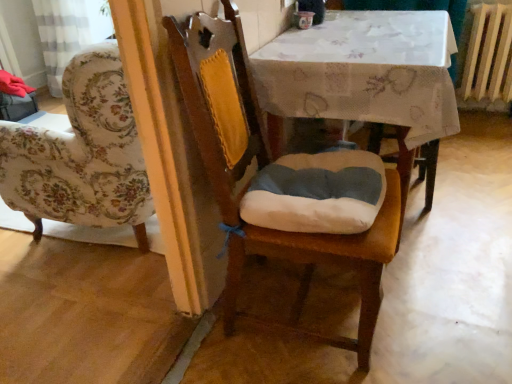
Where is `empty space that is ontop of white fabric table at center`? empty space that is ontop of white fabric table at center is located at coordinates (359, 24).